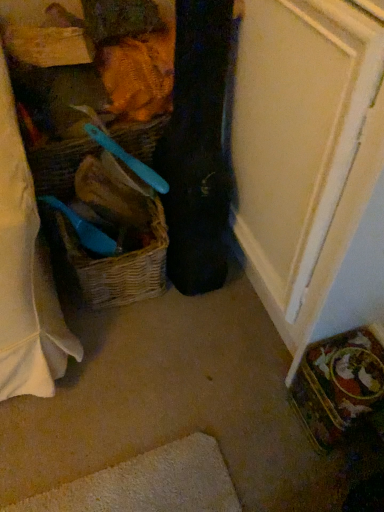
Question: From a real-world perspective, is black fabric guitar case at center physically above woven straw basket at center?

Choices:
 (A) yes
 (B) no

Answer: (A)

Question: Does black fabric guitar case at center have a larger size compared to woven straw basket at center?

Choices:
 (A) no
 (B) yes

Answer: (B)

Question: Does black fabric guitar case at center touch woven straw basket at center?

Choices:
 (A) yes
 (B) no

Answer: (B)

Question: Is black fabric guitar case at center aimed at woven straw basket at center?

Choices:
 (A) yes
 (B) no

Answer: (A)

Question: From the image's perspective, is black fabric guitar case at center beneath woven straw basket at center?

Choices:
 (A) no
 (B) yes

Answer: (B)

Question: Can you confirm if black fabric guitar case at center is wider than woven straw basket at center?

Choices:
 (A) no
 (B) yes

Answer: (A)

Question: Does woven brown picnic basket at left appear on the left side of woven straw basket at center?

Choices:
 (A) yes
 (B) no

Answer: (A)

Question: Is woven brown picnic basket at left outside woven straw basket at center?

Choices:
 (A) no
 (B) yes

Answer: (B)

Question: Does woven brown picnic basket at left have a smaller size compared to woven straw basket at center?

Choices:
 (A) yes
 (B) no

Answer: (B)

Question: Is woven brown picnic basket at left not near woven straw basket at center?

Choices:
 (A) yes
 (B) no

Answer: (B)

Question: Does woven brown picnic basket at left have a greater height compared to woven straw basket at center?

Choices:
 (A) yes
 (B) no

Answer: (A)

Question: Is woven brown picnic basket at left further to camera compared to woven straw basket at center?

Choices:
 (A) no
 (B) yes

Answer: (B)

Question: Is woven straw basket at center facing towards black fabric guitar case at center?

Choices:
 (A) yes
 (B) no

Answer: (A)